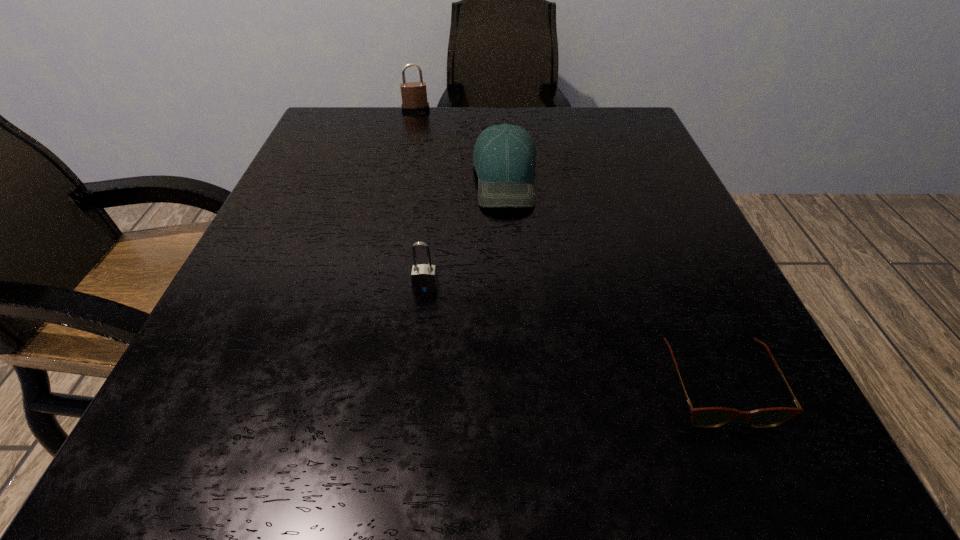
In the image, there is a desktop. What are the coordinates of `vacant space at the far left corner` in the screenshot? It's located at (380, 107).

The width and height of the screenshot is (960, 540). I want to click on free space at the far right corner, so click(618, 118).

The height and width of the screenshot is (540, 960). I want to click on vacant area that lies between the shortest object and the right padlock, so click(571, 336).

Identify the location of free spot between the spectacles and the taller padlock. This screenshot has width=960, height=540. [566, 248].

Image resolution: width=960 pixels, height=540 pixels. I want to click on free space between the farther padlock and the nearest object, so click(566, 248).

The height and width of the screenshot is (540, 960). Identify the location of vacant space in between the nearer padlock and the second object from right to left. (466, 232).

Find the location of a particular element. free space between the rightmost object and the nearer padlock is located at coordinates pos(571,336).

The height and width of the screenshot is (540, 960). I want to click on vacant area that lies between the second nearest object and the leftmost object, so click(x=420, y=198).

Locate an element on the screen. This screenshot has width=960, height=540. free point between the baseball cap and the right padlock is located at coordinates (466, 232).

At what (x,y) coordinates should I click in order to perform the action: click on vacant area between the tallest object and the third object from left to right. Please return your answer as a coordinate pair (x, y). Looking at the image, I should click on (461, 144).